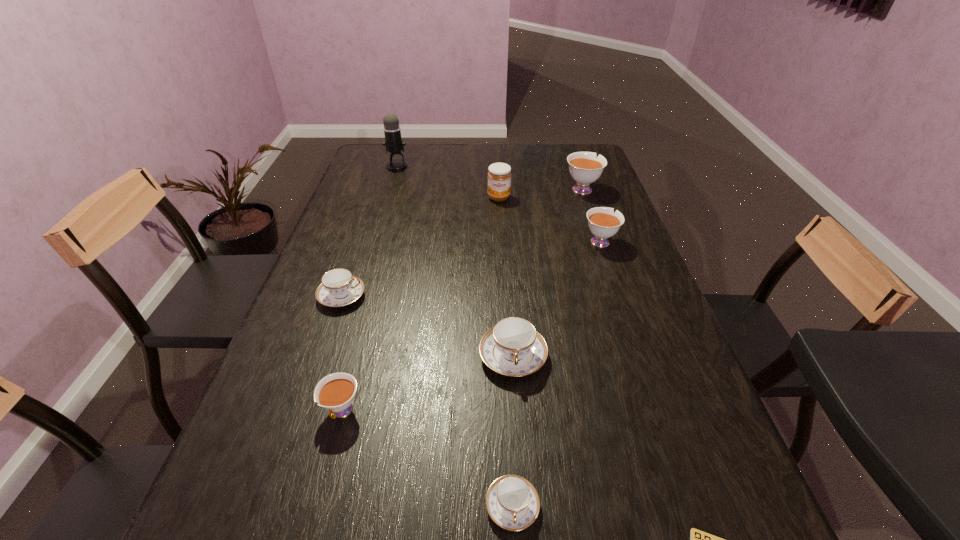
Image resolution: width=960 pixels, height=540 pixels. In order to click on object that ranks as the eighth closest to the nearest blue teacup in this screenshot , I will do `click(393, 142)`.

Image resolution: width=960 pixels, height=540 pixels. Find the location of `the sixth closest teacup to the gray microphone`. the sixth closest teacup to the gray microphone is located at coordinates (512, 502).

Image resolution: width=960 pixels, height=540 pixels. Find the location of `the third closest teacup to the second farthest white teacup`. the third closest teacup to the second farthest white teacup is located at coordinates (339, 287).

Where is `white teacup object that ranks as the third closest to the microphone`? white teacup object that ranks as the third closest to the microphone is located at coordinates (335, 392).

This screenshot has height=540, width=960. Identify the location of the third closest white teacup to the shortest teacup. (585, 168).

Identify which blue teacup is the second closest to the nearest teacup. Please provide its 2D coordinates. Your answer should be formatted as a tuple, i.e. [(x, y)], where the tuple contains the x and y coordinates of a point satisfying the conditions above.

[(339, 287)]

Locate an element on the screen. blue teacup that is the third closest to the jam is located at coordinates (512, 502).